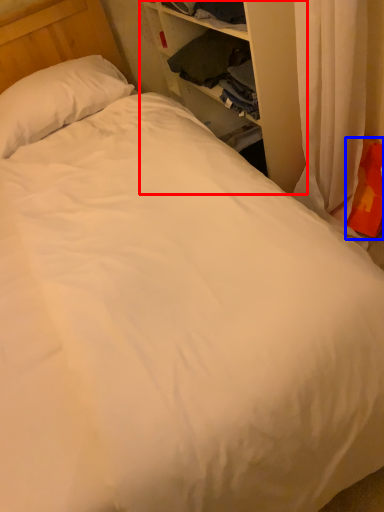
Question: Which object appears closest to the camera in this image, dresser (highlighted by a red box) or pillow (highlighted by a blue box)?

Choices:
 (A) dresser
 (B) pillow

Answer: (A)